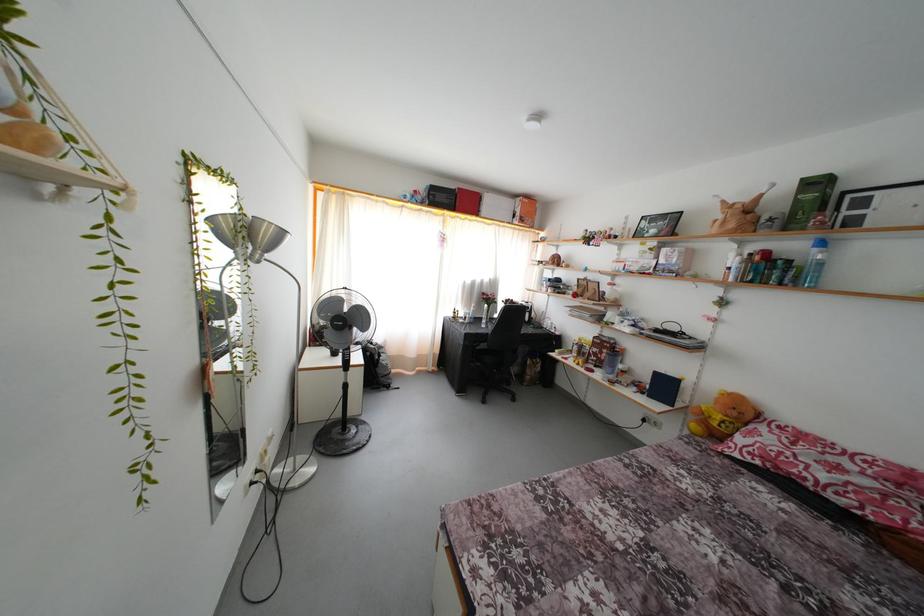
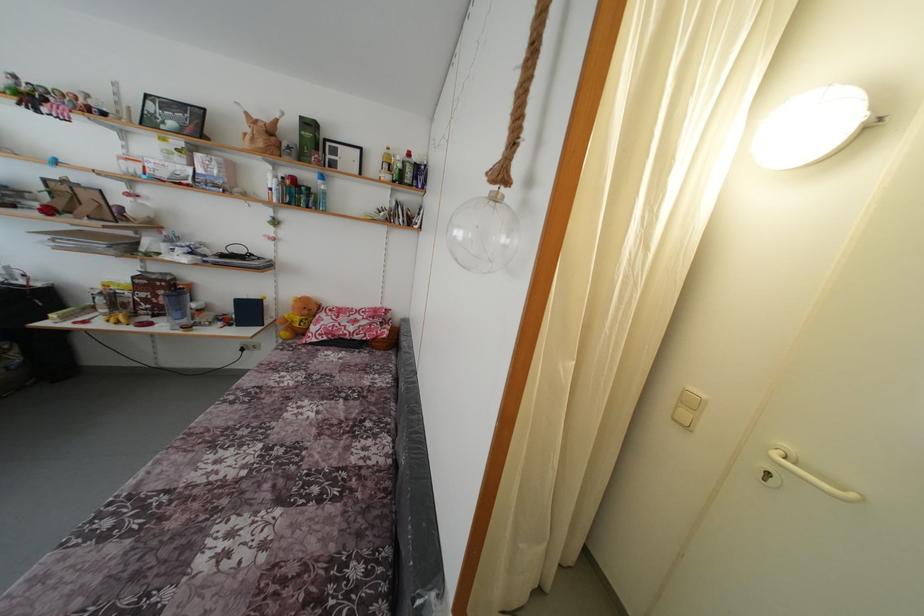
In the second image, find the point that corresponds to (x=600, y=355) in the first image.

(149, 301)